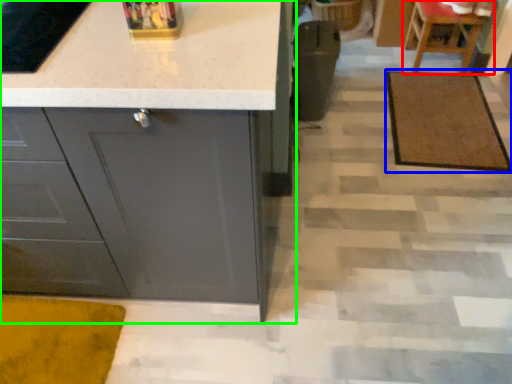
Question: Which object is positioned closest to chair (highlighted by a red box)? Select from doormat (highlighted by a blue box) and cabinetry (highlighted by a green box).

Choices:
 (A) doormat
 (B) cabinetry

Answer: (A)